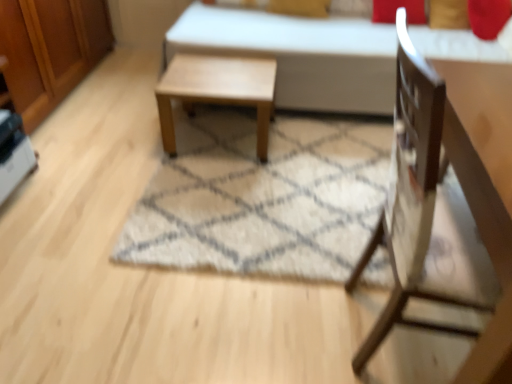
Question: Considering the relative sizes of wooden dresser at left and white shaggy rug at center in the image provided, is wooden dresser at left shorter than white shaggy rug at center?

Choices:
 (A) yes
 (B) no

Answer: (B)

Question: Does wooden dresser at left have a smaller size compared to white shaggy rug at center?

Choices:
 (A) no
 (B) yes

Answer: (A)

Question: Would you say white shaggy rug at center is part of wooden dresser at left's contents?

Choices:
 (A) no
 (B) yes

Answer: (A)

Question: Is wooden dresser at left to the left of white shaggy rug at center from the viewer's perspective?

Choices:
 (A) yes
 (B) no

Answer: (A)

Question: Are wooden dresser at left and white shaggy rug at center far apart?

Choices:
 (A) yes
 (B) no

Answer: (A)

Question: Would you say wooden dresser at left is to the left or to the right of light brown wooden table at center in the picture?

Choices:
 (A) left
 (B) right

Answer: (A)

Question: Is point (72, 66) closer or farther from the camera than point (210, 100)?

Choices:
 (A) closer
 (B) farther

Answer: (B)

Question: In the image, is wooden dresser at left positioned in front of or behind light brown wooden table at center?

Choices:
 (A) front
 (B) behind

Answer: (A)

Question: From a real-world perspective, relative to light brown wooden table at center, is wooden dresser at left vertically above or below?

Choices:
 (A) above
 (B) below

Answer: (A)

Question: Considering their positions, is white shaggy rug at center located in front of or behind white fabric bed at center?

Choices:
 (A) behind
 (B) front

Answer: (B)

Question: Is white shaggy rug at center bigger or smaller than white fabric bed at center?

Choices:
 (A) small
 (B) big

Answer: (A)

Question: Considering the positions of white shaggy rug at center and white fabric bed at center in the image, is white shaggy rug at center wider or thinner than white fabric bed at center?

Choices:
 (A) thin
 (B) wide

Answer: (B)

Question: Is white shaggy rug at center inside the boundaries of white fabric bed at center, or outside?

Choices:
 (A) outside
 (B) inside

Answer: (A)

Question: Is point (66, 89) closer or farther from the camera than point (281, 29)?

Choices:
 (A) farther
 (B) closer

Answer: (A)

Question: Is wooden dresser at left in front of or behind white fabric bed at center in the image?

Choices:
 (A) behind
 (B) front

Answer: (B)